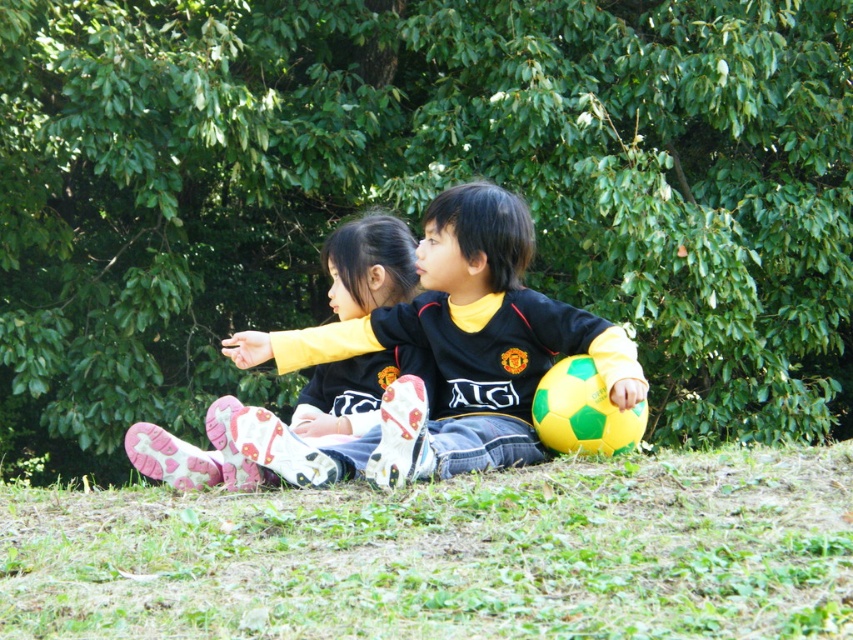
Is green leafy tree at center positioned behind pink fabric socks at lower left?

Yes, green leafy tree at center is further from the viewer.

Is point (618, 280) positioned before point (387, 230)?

No, (618, 280) is behind (387, 230).

Is point (497, 20) in front of point (258, 416)?

That is False.

You are a GUI agent. You are given a task and a screenshot of the screen. Output one action in this format:
    pyautogui.click(x=<x>, y=<y>)
    Task: Click on the green leafy tree at center
    This screenshot has width=853, height=640.
    Given the screenshot: What is the action you would take?
    [x=421, y=189]

The height and width of the screenshot is (640, 853). What are the coordinates of `green leafy tree at center` in the screenshot? It's located at (421, 189).

The width and height of the screenshot is (853, 640). What do you see at coordinates (421, 189) in the screenshot?
I see `green leafy tree at center` at bounding box center [421, 189].

The width and height of the screenshot is (853, 640). Describe the element at coordinates (421, 189) in the screenshot. I see `green leafy tree at center` at that location.

Locate an element on the screen. This screenshot has width=853, height=640. green leafy tree at center is located at coordinates (421, 189).

Can you confirm if green leafy tree at center is smaller than black jersey at center?

Actually, green leafy tree at center might be larger than black jersey at center.

Does green leafy tree at center appear on the right side of black jersey at center?

No, green leafy tree at center is not to the right of black jersey at center.

Who is more distant from viewer, (241, 266) or (354, 349)?

Point (241, 266)

Identify the location of green leafy tree at center. This screenshot has height=640, width=853. (421, 189).